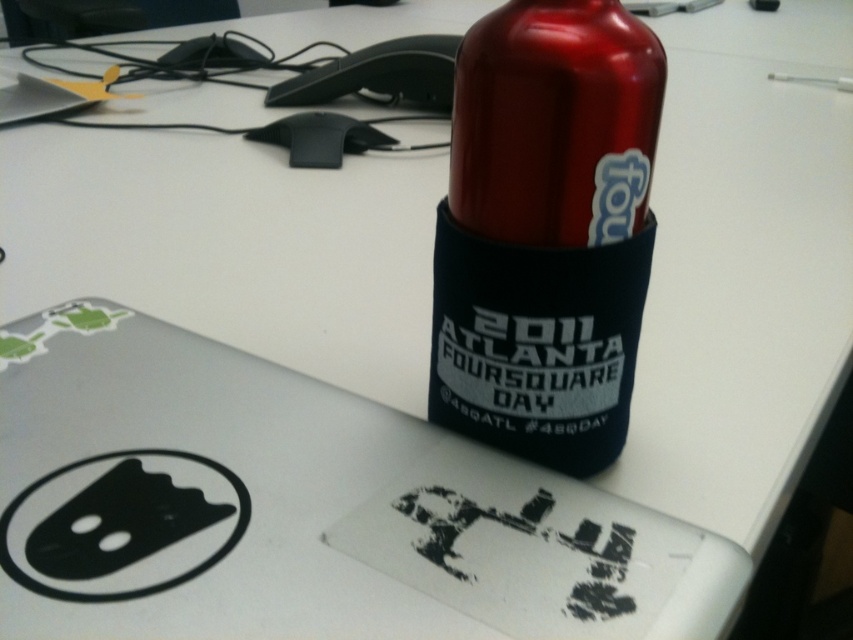
Question: Which point appears closest to the camera in this image?

Choices:
 (A) (606, 193)
 (B) (1, 600)

Answer: (B)

Question: Estimate the real-world distances between objects in this image. Which object is closer to the silver metallic laptop at upper center?

Choices:
 (A) matte white sticker at bottle top
 (B) metallic red bottle at upper right

Answer: (B)

Question: Can you confirm if silver metallic laptop at upper center is positioned to the left of metallic red bottle at upper right?

Choices:
 (A) no
 (B) yes

Answer: (B)

Question: Is silver metallic laptop at upper center bigger than matte white sticker at bottle top?

Choices:
 (A) no
 (B) yes

Answer: (B)

Question: Which of the following is the farthest from the observer?

Choices:
 (A) metallic red bottle at upper right
 (B) matte white sticker at bottle top
 (C) silver metallic laptop at upper center

Answer: (B)

Question: Observing the image, what is the correct spatial positioning of silver metallic laptop at upper center in reference to matte white sticker at bottle top?

Choices:
 (A) below
 (B) above

Answer: (A)